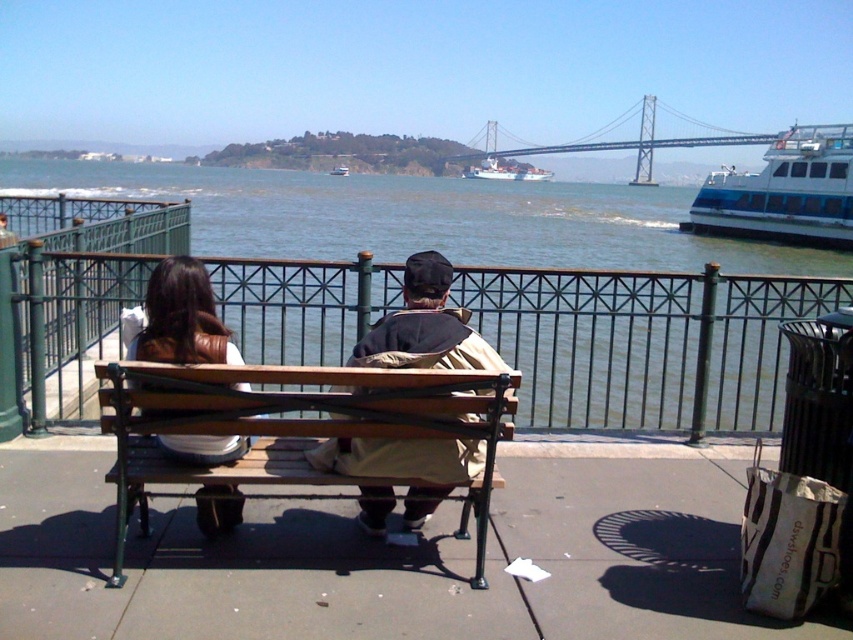
Which of these two, leather jacket at center or metallic gray bridge at upper center, stands taller?

Standing taller between the two is metallic gray bridge at upper center.

Does leather jacket at center appear over metallic gray bridge at upper center?

Actually, leather jacket at center is below metallic gray bridge at upper center.

The height and width of the screenshot is (640, 853). I want to click on leather jacket at center, so click(x=181, y=317).

Which of these two, tan fabric jacket at center or blue metallic ferry at center, stands shorter?

Standing shorter between the two is tan fabric jacket at center.

Locate an element on the screen. tan fabric jacket at center is located at coordinates (425, 326).

Can you confirm if leather jacket at center is taller than blue metallic ferry at center?

No, leather jacket at center is not taller than blue metallic ferry at center.

At what (x,y) coordinates should I click in order to perform the action: click on leather jacket at center. Please return your answer as a coordinate pair (x, y). This screenshot has width=853, height=640. Looking at the image, I should click on (181, 317).

Find the location of `leather jacket at center`. leather jacket at center is located at coordinates (181, 317).